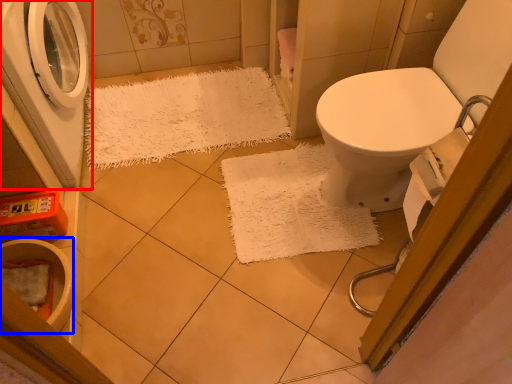
Question: Which object is closer to the camera taking this photo, washing machine (highlighted by a red box) or toilet bowl (highlighted by a blue box)?

Choices:
 (A) washing machine
 (B) toilet bowl

Answer: (A)